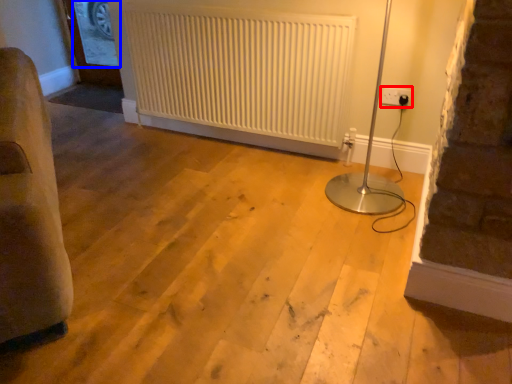
Question: Which object is closer to the camera taking this photo, electric outlet (highlighted by a red box) or window screen (highlighted by a blue box)?

Choices:
 (A) electric outlet
 (B) window screen

Answer: (A)